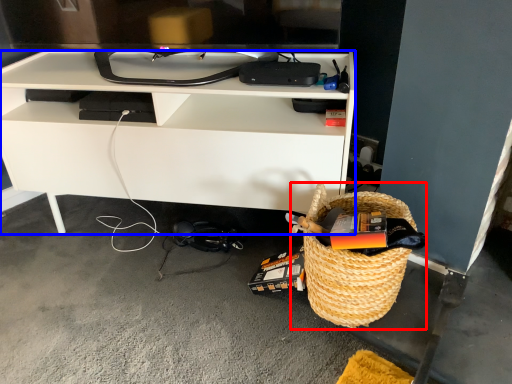
Question: Among these objects, which one is nearest to the camera, picnic basket (highlighted by a red box) or desk (highlighted by a blue box)?

Choices:
 (A) picnic basket
 (B) desk

Answer: (A)